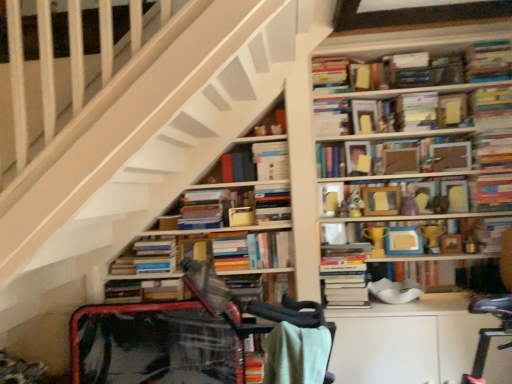
The image size is (512, 384). In order to click on empty space that is ontop of hardcover books at center, which is counted as the fifth book, starting from the bottom (from a real-world perspective) in this screenshot , I will do `click(246, 230)`.